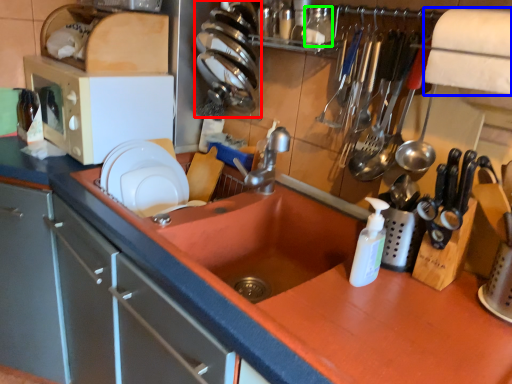
Question: Estimate the real-world distances between objects in this image. Which object is farther from tableware (highlighted by a red box), exhaust hood (highlighted by a blue box) or bottle (highlighted by a green box)?

Choices:
 (A) exhaust hood
 (B) bottle

Answer: (A)